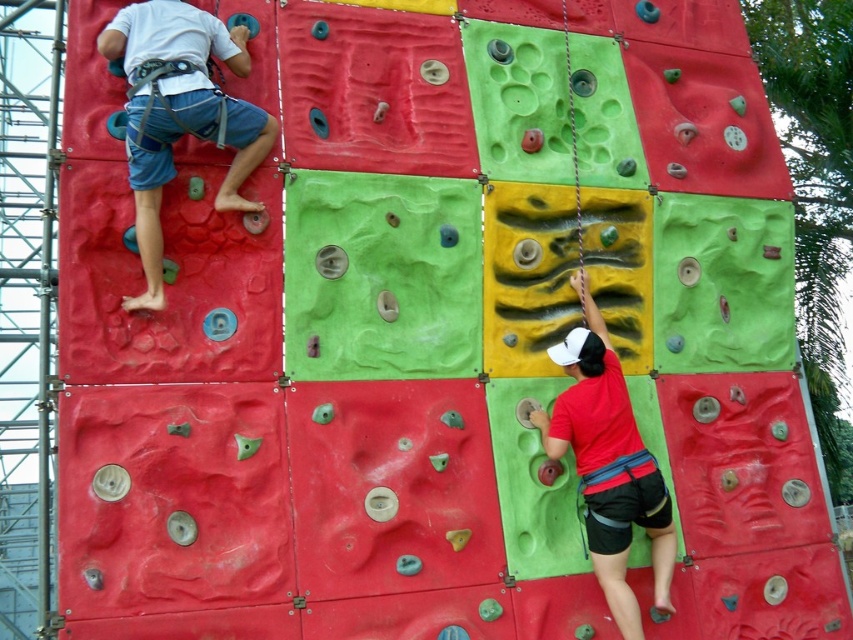
You are a climber trying to reach the top of the climbing wall. You notice a specific point marked at coordinates point (178, 113). Based on the scene description, where exactly is this point located?

The point (178, 113) is located on the matte blue shorts at left.

Where is the matte blue shorts at left located in the image?

The matte blue shorts at left is located at point (178, 113) in the image.

You are observing a climbing wall with two climbers. There is a person wearing matte blue shorts at left and another wearing matte red shirt at lower right. From the perspective of someone standing at the base of the wall, which climber is higher up?

The matte blue shorts at left is located above the matte red shirt at lower right, so the climber with matte blue shorts at left is higher up on the wall.